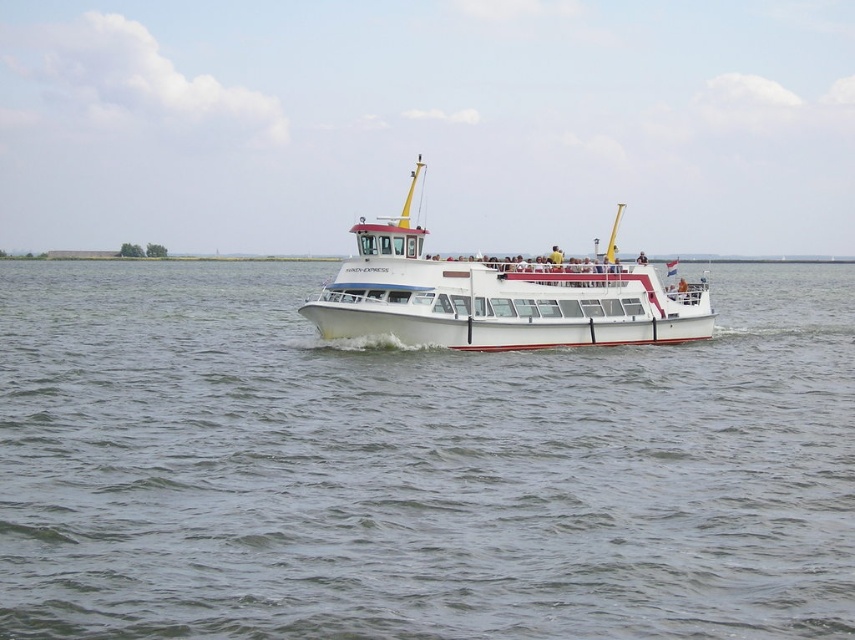
Question: Which object appears farthest from the camera in this image?

Choices:
 (A) white glossy boat at center
 (B) white water at center

Answer: (A)

Question: Does white water at center appear on the right side of white glossy boat at center?

Choices:
 (A) yes
 (B) no

Answer: (B)

Question: Which point is closer to the camera taking this photo?

Choices:
 (A) [x=134, y=568]
 (B) [x=323, y=333]

Answer: (A)

Question: In this image, where is white water at center located relative to white glossy boat at center?

Choices:
 (A) below
 (B) above

Answer: (A)

Question: Is white water at center to the left of white glossy boat at center from the viewer's perspective?

Choices:
 (A) no
 (B) yes

Answer: (B)